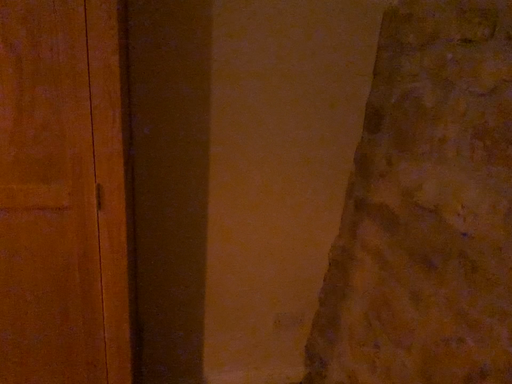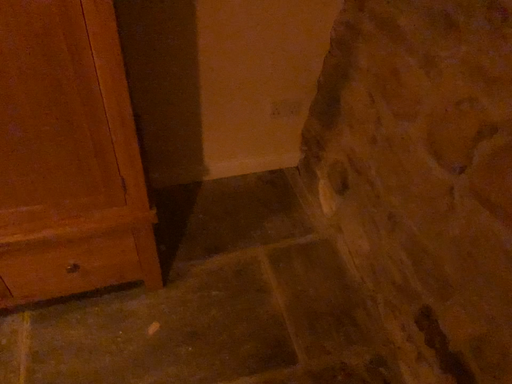
Question: How did the camera likely rotate when shooting the video?

Choices:
 (A) rotated upward
 (B) rotated downward

Answer: (B)